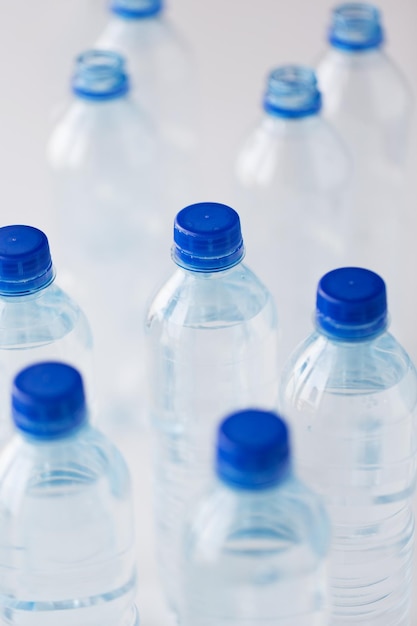
The image size is (417, 626). Identify the location of bottles. (95, 501), (258, 533), (351, 458), (225, 372), (61, 342), (123, 141), (298, 150), (377, 83), (144, 54).